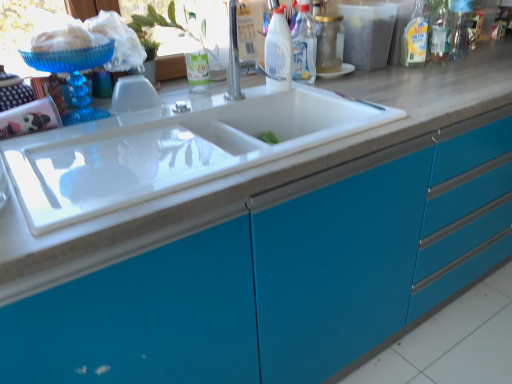
Where is `vacant space that is to the left of white glossy bottle at upper center, positioned as the first bottle in left-to-right order`? The width and height of the screenshot is (512, 384). vacant space that is to the left of white glossy bottle at upper center, positioned as the first bottle in left-to-right order is located at coordinates (225, 99).